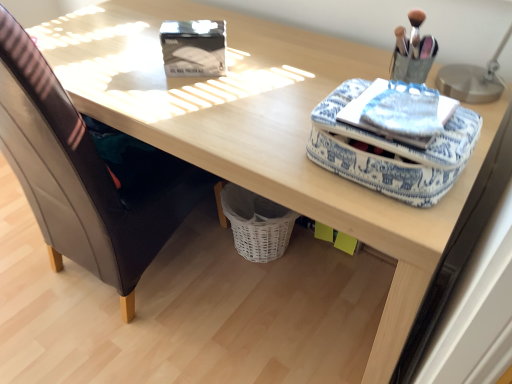
Question: Is blue fabric case at upper right shorter than blue printed fabric notepad at upper right?

Choices:
 (A) no
 (B) yes

Answer: (A)

Question: Can you confirm if blue fabric case at upper right is thinner than blue printed fabric notepad at upper right?

Choices:
 (A) no
 (B) yes

Answer: (A)

Question: From the image's perspective, would you say blue fabric case at upper right is positioned over blue printed fabric notepad at upper right?

Choices:
 (A) no
 (B) yes

Answer: (A)

Question: Is blue printed fabric notepad at upper right at the back of blue fabric case at upper right?

Choices:
 (A) no
 (B) yes

Answer: (A)

Question: Is blue fabric case at upper right closer to camera compared to blue printed fabric notepad at upper right?

Choices:
 (A) yes
 (B) no

Answer: (A)

Question: Is blue fabric case at upper right smaller than blue printed fabric notepad at upper right?

Choices:
 (A) yes
 (B) no

Answer: (B)

Question: Is leather at left outside metallic silver table lamp at upper right?

Choices:
 (A) no
 (B) yes

Answer: (B)

Question: Considering the relative sizes of leather at left and metallic silver table lamp at upper right in the image provided, is leather at left taller than metallic silver table lamp at upper right?

Choices:
 (A) yes
 (B) no

Answer: (A)

Question: Does leather at left lie in front of metallic silver table lamp at upper right?

Choices:
 (A) no
 (B) yes

Answer: (B)

Question: Can you confirm if leather at left is bigger than metallic silver table lamp at upper right?

Choices:
 (A) yes
 (B) no

Answer: (A)

Question: From a real-world perspective, does leather at left sit lower than metallic silver table lamp at upper right?

Choices:
 (A) no
 (B) yes

Answer: (B)

Question: Is leather at left with metallic silver table lamp at upper right?

Choices:
 (A) no
 (B) yes

Answer: (A)

Question: Is the surface of blue fabric case at upper right in direct contact with leather at left?

Choices:
 (A) yes
 (B) no

Answer: (B)